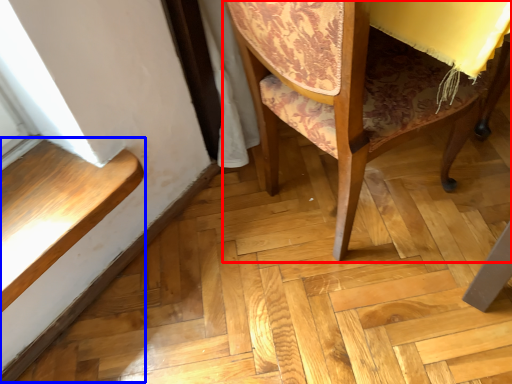
Question: Which point is further to the camera, chair (highlighted by a red box) or stairwell (highlighted by a blue box)?

Choices:
 (A) chair
 (B) stairwell

Answer: (B)